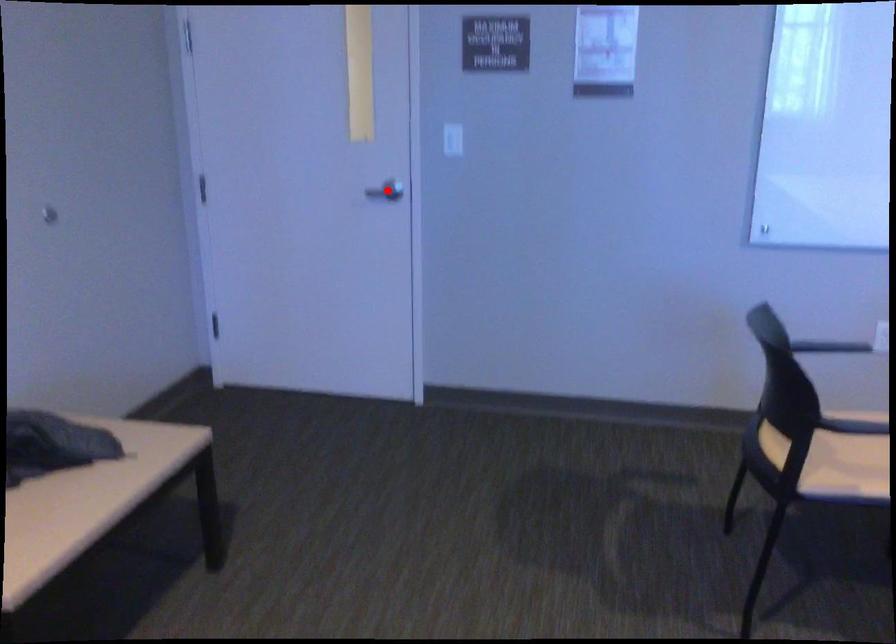
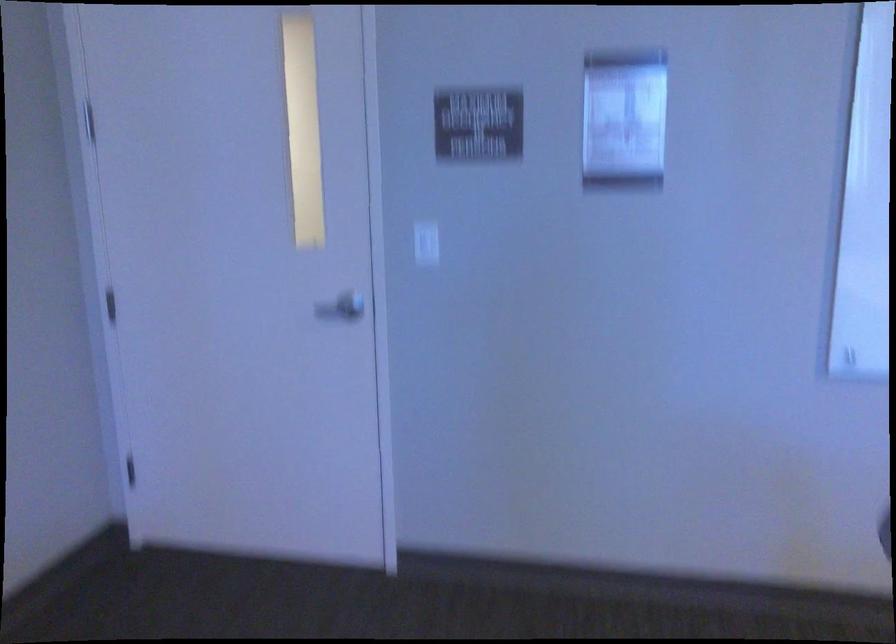
Where in the second image is the point corresponding to the highlighted location from the first image?

(343, 306)